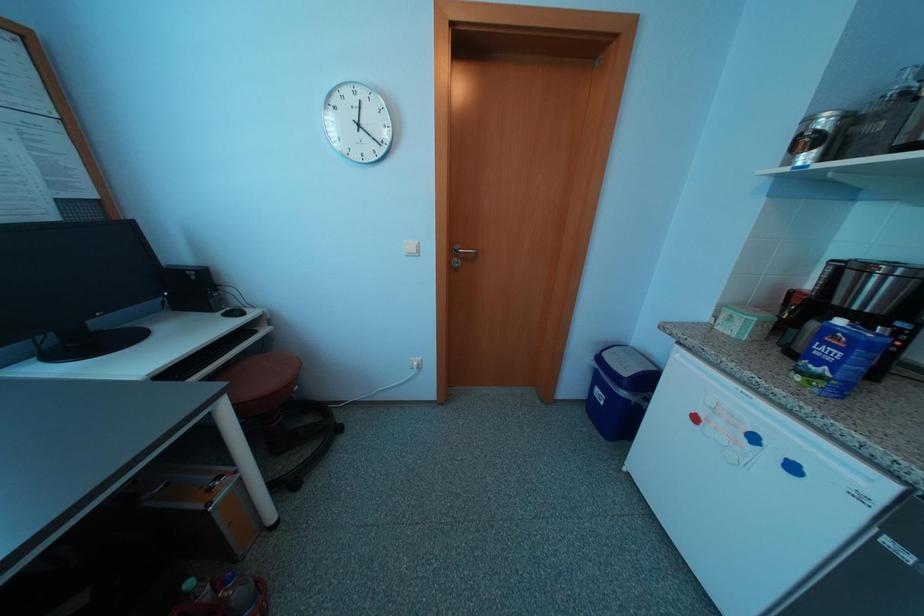
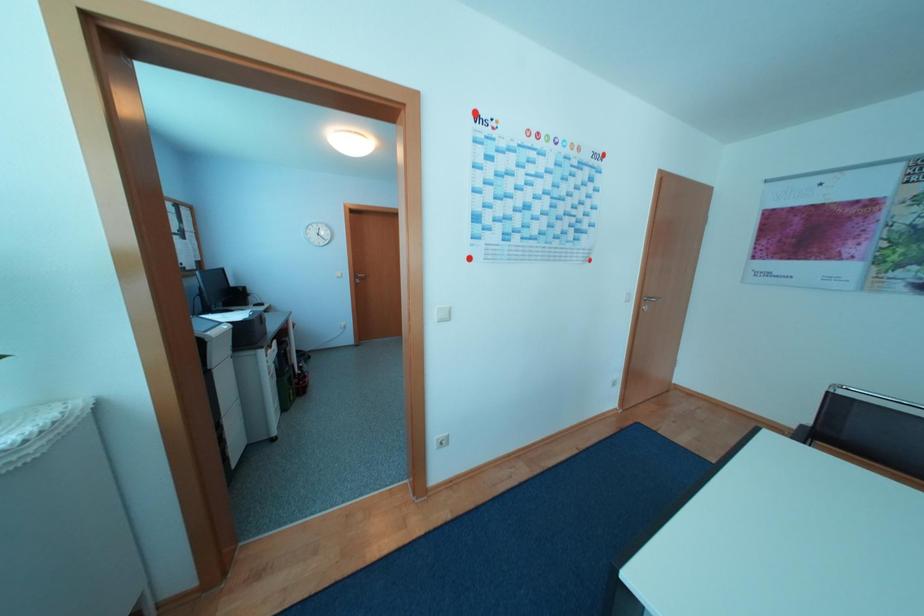
Question: Which direction would the cameraman need to move to produce the second image? Reply with the corresponding letter.

Choices:
 (A) Left
 (B) Right
 (C) Forward
 (D) Backward

Answer: (D)